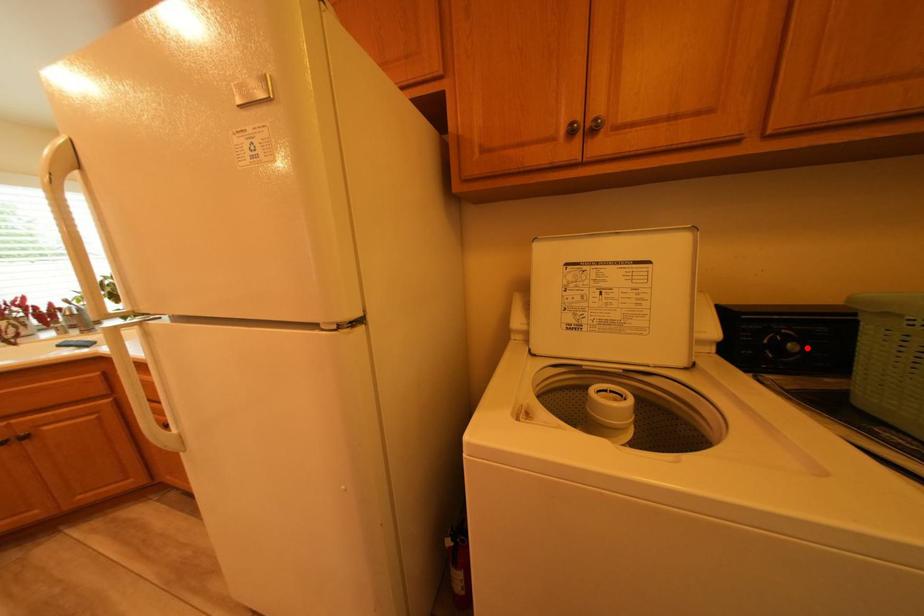
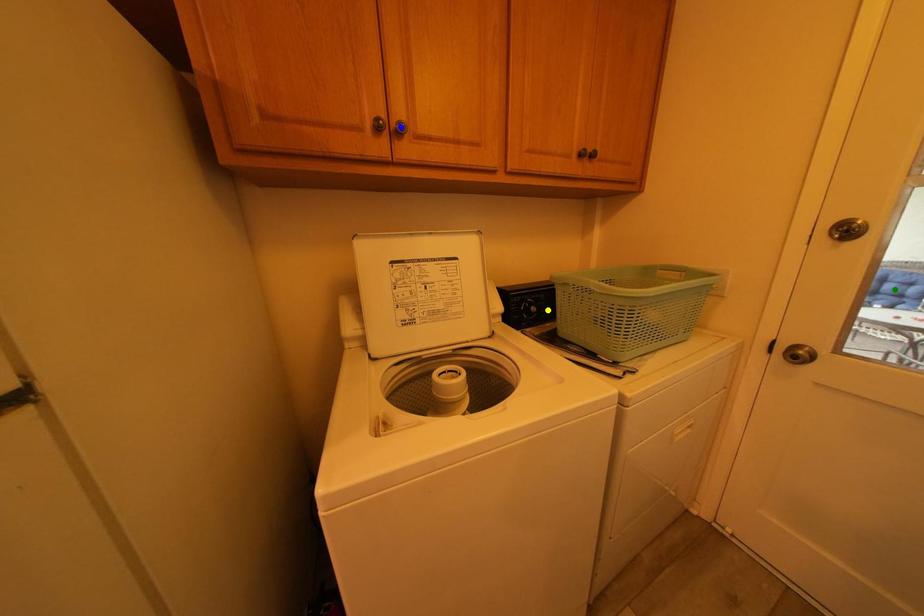
Question: I am providing you with two images of the same scene from different viewpoints. A red point is marked on the first image. You are given multiple points on the second image. Which point in image 2 is actually the same real-world point as the red point in image 1?

Choices:
 (A) yellow point
 (B) green point
 (C) blue point

Answer: (A)